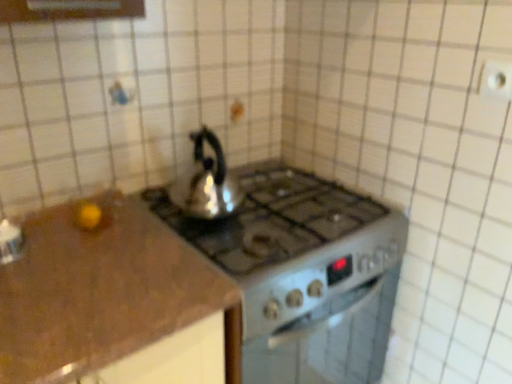
Question: Looking at the image, does shiny metallic kettle at center seem bigger or smaller compared to satin silver gas stove at center?

Choices:
 (A) small
 (B) big

Answer: (A)

Question: In the image, is shiny metallic kettle at center positioned in front of or behind satin silver gas stove at center?

Choices:
 (A) behind
 (B) front

Answer: (A)

Question: Estimate the real-world distances between objects in this image. Which object is closer to the satin silver gas stove at center?

Choices:
 (A) white plastic electric outlet at upper right
 (B) shiny metallic kettle at center

Answer: (B)

Question: Which of these objects is positioned farthest from the shiny metallic kettle at center?

Choices:
 (A) white plastic electric outlet at upper right
 (B) satin silver gas stove at center

Answer: (A)